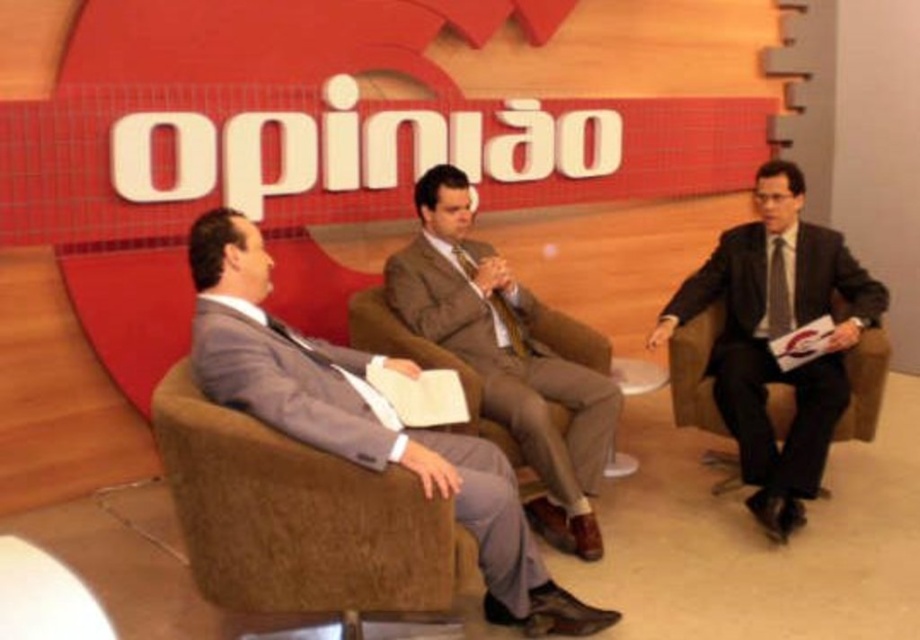
Question: Based on their relative distances, which object is farther from the matte gray suit at center?

Choices:
 (A) matte black suit at right
 (B) brown fabric suit at center
 (C) brown fabric swivel chair at center

Answer: (A)

Question: Does matte black suit at right appear on the right side of brown fabric suit at center?

Choices:
 (A) no
 (B) yes

Answer: (B)

Question: Is brown fabric swivel chair at center above brown fabric suit at center?

Choices:
 (A) no
 (B) yes

Answer: (A)

Question: Which object is the farthest from the brown fabric suit at center?

Choices:
 (A) matte gray suit at center
 (B) brown fabric swivel chair at center
 (C) matte black suit at right

Answer: (B)

Question: Can you confirm if matte gray suit at center is smaller than brown fabric suit at center?

Choices:
 (A) no
 (B) yes

Answer: (A)

Question: Among these points, which one is farthest from the camera?

Choices:
 (A) (296, 486)
 (B) (354, 440)
 (C) (498, 378)

Answer: (C)